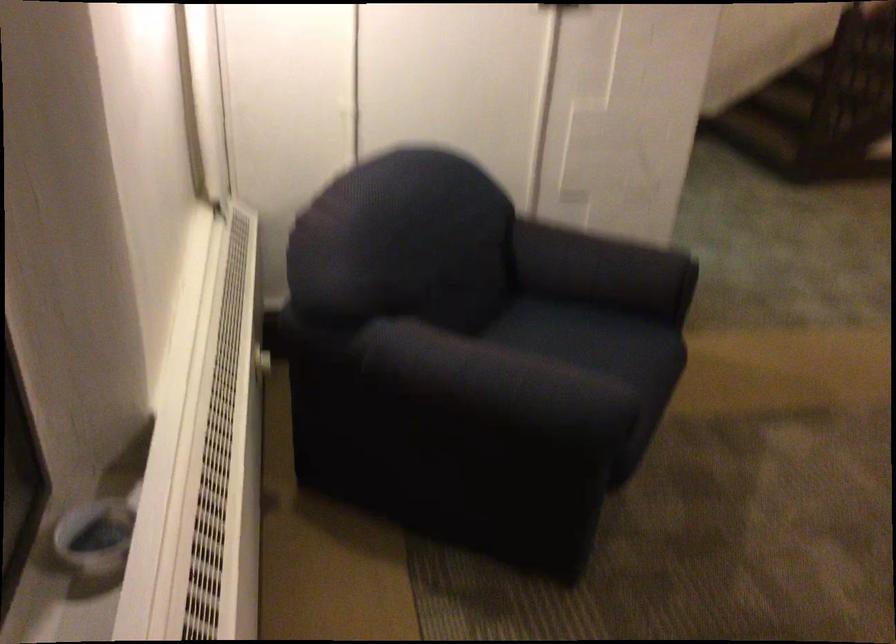
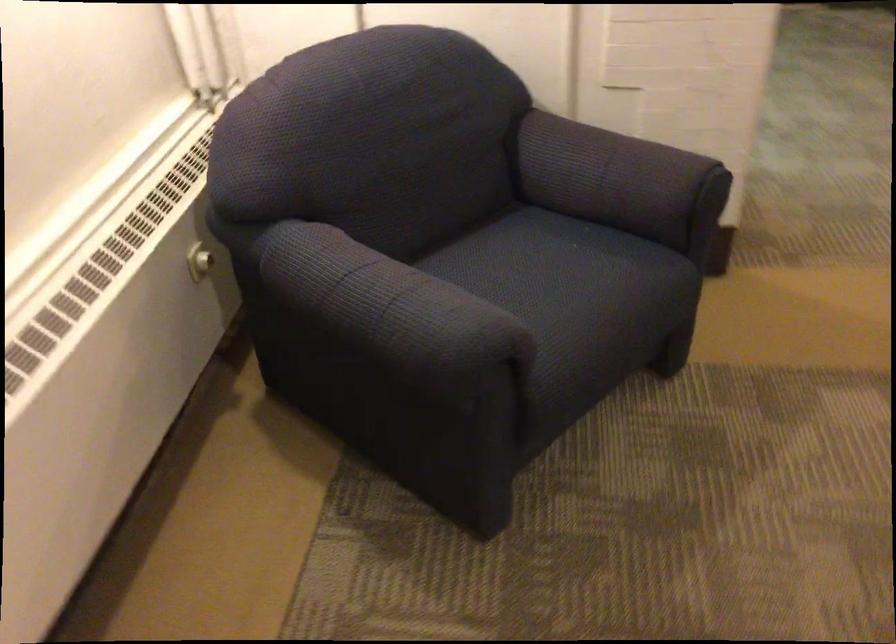
Question: The camera is either moving clockwise (left) or counter-clockwise (right) around the object. The first image is from the beginning of the video and the second image is from the end. Is the camera moving left or right when shooting the video?

Choices:
 (A) Left
 (B) Right

Answer: (B)